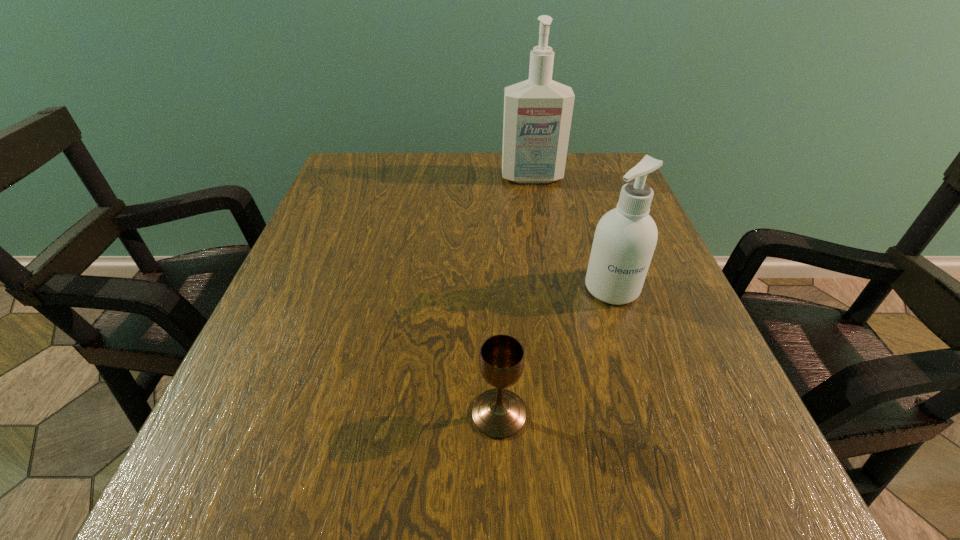
Identify the location of free spot between the shortest object and the taller cleansing agent. (516, 296).

Find the location of a particular element. The height and width of the screenshot is (540, 960). vacant area that lies between the nearer cleansing agent and the nearest object is located at coordinates (556, 351).

At what (x,y) coordinates should I click in order to perform the action: click on vacant area that lies between the shortest object and the tallest object. Please return your answer as a coordinate pair (x, y). Looking at the image, I should click on (516, 296).

Where is `vacant region between the nearest object and the second tallest object`? vacant region between the nearest object and the second tallest object is located at coordinates (556, 351).

This screenshot has width=960, height=540. Identify the location of free space between the shorter cleansing agent and the chalice. (556, 351).

Locate an element on the screen. object that stands as the second closest to the farther cleansing agent is located at coordinates (498, 413).

Select which object is the closest to the second nearest object. Please provide its 2D coordinates. Your answer should be formatted as a tuple, i.e. [(x, y)], where the tuple contains the x and y coordinates of a point satisfying the conditions above.

[(498, 413)]